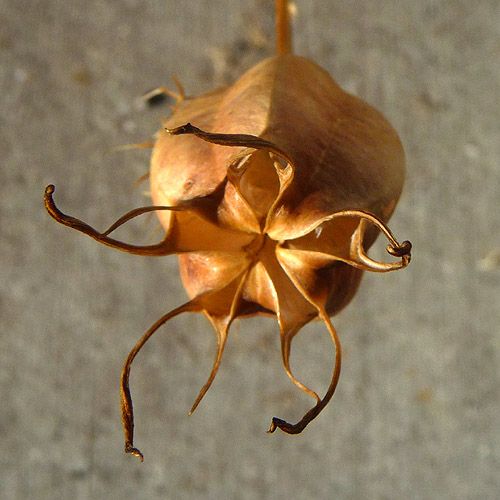
The width and height of the screenshot is (500, 500). I want to click on surface, so click(286, 107).